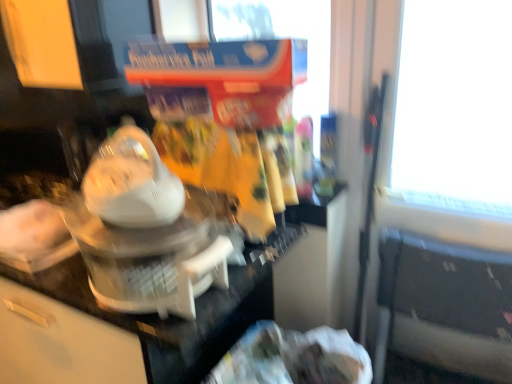
This screenshot has width=512, height=384. I want to click on black plastic chair at lower right, so click(444, 306).

Image resolution: width=512 pixels, height=384 pixels. I want to click on black plastic chair at lower right, so click(444, 306).

Locate an element on the screen. counter top below the black plastic chair at lower right (from a real-world perspective) is located at coordinates (175, 316).

Is white glossy counter top at center oriented away from black plastic chair at lower right?

No, white glossy counter top at center's orientation is not away from black plastic chair at lower right.

From a real-world perspective, which object rests below the other?

white glossy counter top at center.

Is white glossy counter top at center touching black plastic chair at lower right?

white glossy counter top at center and black plastic chair at lower right are not in contact.

Is black plastic chair at lower right facing away from white glossy counter top at center?

No, black plastic chair at lower right's orientation is not away from white glossy counter top at center.

Who is smaller, black plastic chair at lower right or white glossy counter top at center?

black plastic chair at lower right.

Between black plastic chair at lower right and white glossy counter top at center, which one appears on the left side from the viewer's perspective?

Positioned to the left is white glossy counter top at center.

In the scene shown: Is white plastic blender at center far from white glossy counter top at center?

No, there isn't a large distance between white plastic blender at center and white glossy counter top at center.

Is white plastic blender at center oriented away from white glossy counter top at center?

No, white plastic blender at center is not facing the opposite direction of white glossy counter top at center.

From a real-world perspective, is white plastic blender at center physically located above or below white glossy counter top at center?

From a real-world perspective, white plastic blender at center is physically above white glossy counter top at center.

Is white plastic blender at center positioned in front of white glossy counter top at center?

Yes, white plastic blender at center is closer to the camera.

From the image's perspective, is black plastic chair at lower right above white plastic blender at center?

No, from the image's perspective, black plastic chair at lower right is not above white plastic blender at center.

Is black plastic chair at lower right closer to camera compared to white plastic blender at center?

No, it is behind white plastic blender at center.

Would you say black plastic chair at lower right is to the left or to the right of white plastic blender at center in the picture?

Based on their positions, black plastic chair at lower right is located to the right of white plastic blender at center.

Is black plastic chair at lower right located outside white plastic blender at center?

Yes, black plastic chair at lower right is outside of white plastic blender at center.

From a real-world perspective, between white glossy counter top at center and white plastic blender at center, who is vertically higher?

white plastic blender at center.

From the image's perspective, would you say white glossy counter top at center is positioned over white plastic blender at center?

No, from the image's perspective, white glossy counter top at center is not over white plastic blender at center.

Considering the relative sizes of white glossy counter top at center and white plastic blender at center in the image provided, is white glossy counter top at center wider than white plastic blender at center?

Yes, white glossy counter top at center is wider than white plastic blender at center.

Considering the relative sizes of white glossy counter top at center and white plastic blender at center in the image provided, is white glossy counter top at center bigger than white plastic blender at center?

Yes, white glossy counter top at center is bigger than white plastic blender at center.

From the picture: Is white plastic blender at center positioned with its back to black plastic chair at lower right?

white plastic blender at center does not have its back to black plastic chair at lower right.

Who is smaller, white plastic blender at center or black plastic chair at lower right?

white plastic blender at center is smaller.

Does white plastic blender at center lie behind black plastic chair at lower right?

No, the depth of white plastic blender at center is less than that of black plastic chair at lower right.

The image size is (512, 384). Identify the location of kitchen appliance in front of the black plastic chair at lower right. (143, 232).

Where is `chair located above the white glossy counter top at center (from a real-world perspective)`? Image resolution: width=512 pixels, height=384 pixels. chair located above the white glossy counter top at center (from a real-world perspective) is located at coordinates (444, 306).

In order to click on chair that is behind the white glossy counter top at center in this screenshot , I will do `click(444, 306)`.

Considering their positions, is white plastic blender at center positioned further to black plastic chair at lower right than white glossy counter top at center?

The object further to black plastic chair at lower right is white plastic blender at center.

Estimate the real-world distances between objects in this image. Which object is further from black plastic chair at lower right, white glossy counter top at center or white plastic blender at center?

white plastic blender at center.

From the image, which object appears to be nearer to white glossy counter top at center, white plastic blender at center or black plastic chair at lower right?

white plastic blender at center.

Which object lies nearer to the anchor point white plastic blender at center, black plastic chair at lower right or white glossy counter top at center?

white glossy counter top at center is positioned closer to the anchor white plastic blender at center.

Consider the image. Estimate the real-world distances between objects in this image. Which object is closer to white plastic blender at center, white glossy counter top at center or black plastic chair at lower right?

white glossy counter top at center.

Looking at the image, which one is located further to white glossy counter top at center, black plastic chair at lower right or white plastic blender at center?

black plastic chair at lower right lies further to white glossy counter top at center than the other object.

Locate an element on the screen. kitchen appliance between white glossy counter top at center and black plastic chair at lower right from left to right is located at coordinates (143, 232).